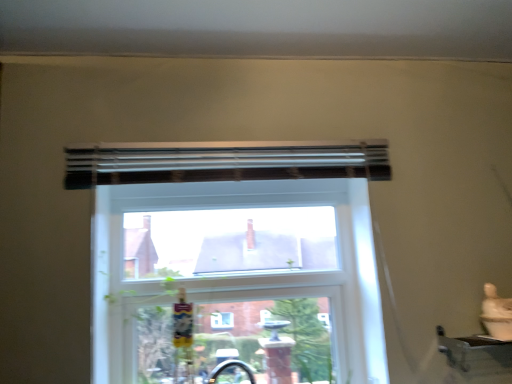
Question: Is black matte curtain at upper center directly adjacent to clear glass window at center?

Choices:
 (A) yes
 (B) no

Answer: (B)

Question: Would you say black matte curtain at upper center is a long distance from clear glass window at center?

Choices:
 (A) yes
 (B) no

Answer: (B)

Question: Can you confirm if black matte curtain at upper center is positioned to the right of clear glass window at center?

Choices:
 (A) yes
 (B) no

Answer: (A)

Question: Is clear glass window at center at the back of black matte curtain at upper center?

Choices:
 (A) no
 (B) yes

Answer: (A)

Question: From a real-world perspective, is black matte curtain at upper center over clear glass window at center?

Choices:
 (A) yes
 (B) no

Answer: (A)

Question: In terms of size, does black matte curtain at upper center appear bigger or smaller than clear glass window at center?

Choices:
 (A) small
 (B) big

Answer: (A)

Question: Is point (194, 180) closer or farther from the camera than point (95, 291)?

Choices:
 (A) farther
 (B) closer

Answer: (A)

Question: In terms of width, does black matte curtain at upper center look wider or thinner when compared to clear glass window at center?

Choices:
 (A) thin
 (B) wide

Answer: (B)

Question: Is black matte curtain at upper center in front of or behind clear glass window at center in the image?

Choices:
 (A) front
 (B) behind

Answer: (A)

Question: Considering the positions of black matte curtain at upper center and metallic silver window sill at lower right in the image, is black matte curtain at upper center taller or shorter than metallic silver window sill at lower right?

Choices:
 (A) tall
 (B) short

Answer: (A)

Question: Which is correct: black matte curtain at upper center is inside metallic silver window sill at lower right, or outside of it?

Choices:
 (A) inside
 (B) outside

Answer: (B)

Question: Is point (105, 167) positioned closer to the camera than point (494, 339)?

Choices:
 (A) closer
 (B) farther

Answer: (B)

Question: Considering their positions, is black matte curtain at upper center located in front of or behind metallic silver window sill at lower right?

Choices:
 (A) behind
 (B) front

Answer: (A)

Question: Based on their sizes in the image, would you say clear glass window at center is bigger or smaller than black matte curtain at upper center?

Choices:
 (A) small
 (B) big

Answer: (B)

Question: From the image's perspective, is clear glass window at center positioned above or below black matte curtain at upper center?

Choices:
 (A) below
 (B) above

Answer: (A)